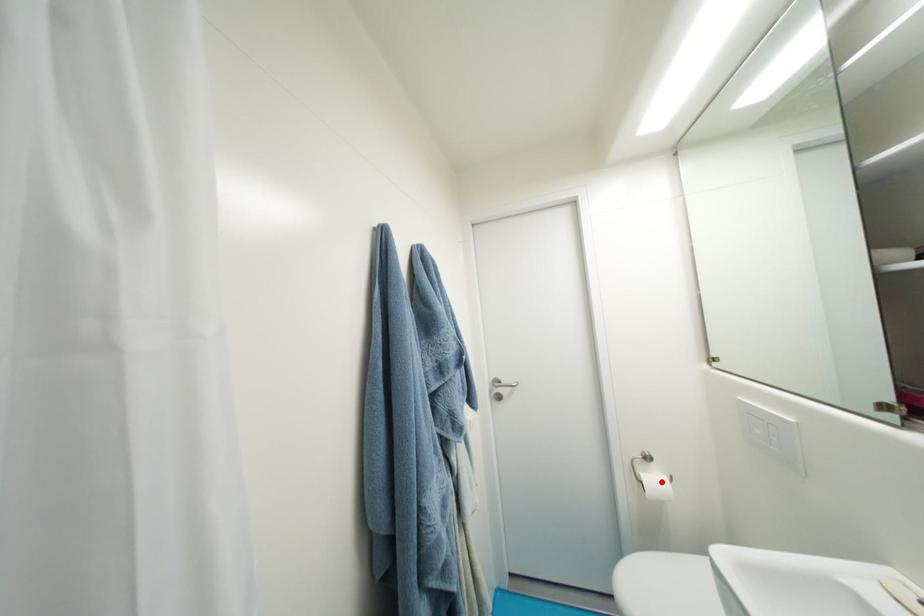
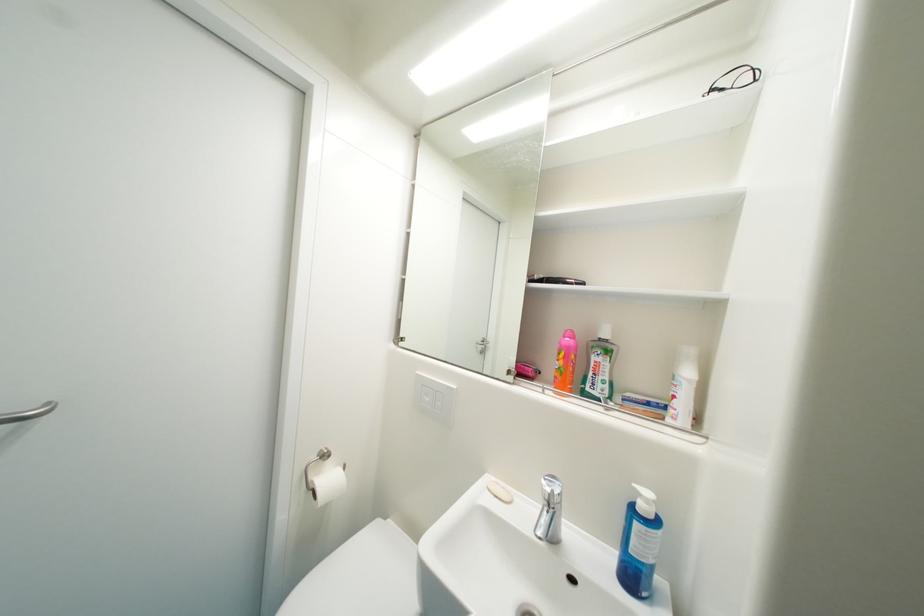
Find the pixel in the second image that matches the highlighted location in the first image.

(337, 482)